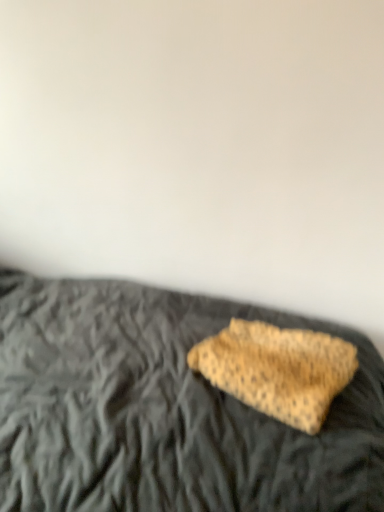
What do you see at coordinates (163, 410) in the screenshot? I see `leopard print pillow at center` at bounding box center [163, 410].

What is the approximate height of leopard print pillow at center?

leopard print pillow at center is 1.03 meters tall.

Locate an element on the screen. This screenshot has width=384, height=512. leopard print pillow at center is located at coordinates (163, 410).

From the picture: What is the approximate height of leopard print fabric at center?

The height of leopard print fabric at center is 3.94 inches.

At what (x,y) coordinates should I click in order to perform the action: click on leopard print fabric at center. Please return your answer as a coordinate pair (x, y). The image size is (384, 512). Looking at the image, I should click on (277, 369).

Describe the element at coordinates (277, 369) in the screenshot. I see `leopard print fabric at center` at that location.

What are the coordinates of `leopard print pillow at center` in the screenshot? It's located at (163, 410).

Which is more to the left, leopard print fabric at center or leopard print pillow at center?

Positioned to the left is leopard print pillow at center.

Which object is closer to the camera, leopard print fabric at center or leopard print pillow at center?

leopard print pillow at center is in front.

Which point is more forward, [209,342] or [25,410]?

The point [25,410] is more forward.

From the image's perspective, is leopard print fabric at center located beneath leopard print pillow at center?

No, from the image's perspective, leopard print fabric at center is not beneath leopard print pillow at center.

From a real-world perspective, is leopard print fabric at center positioned under leopard print pillow at center based on gravity?

No, from a real-world perspective, leopard print fabric at center is not beneath leopard print pillow at center.

Which object is thinner, leopard print fabric at center or leopard print pillow at center?

leopard print fabric at center is thinner.

Considering the sizes of objects leopard print fabric at center and leopard print pillow at center in the image provided, who is taller, leopard print fabric at center or leopard print pillow at center?

leopard print pillow at center.

Does leopard print fabric at center have a larger size compared to leopard print pillow at center?

Incorrect, leopard print fabric at center is not larger than leopard print pillow at center.

Can we say leopard print fabric at center lies outside leopard print pillow at center?

That's incorrect, leopard print fabric at center is not completely outside leopard print pillow at center.

Based on the photo, is leopard print fabric at center next to leopard print pillow at center?

No, leopard print fabric at center is not making contact with leopard print pillow at center.

Could you tell me if leopard print fabric at center is turned towards leopard print pillow at center?

Yes, leopard print fabric at center faces towards leopard print pillow at center.

From the picture: What's the angular difference between leopard print fabric at center and leopard print pillow at center's facing directions?

The facing directions of leopard print fabric at center and leopard print pillow at center are 20.5 degrees apart.

The width and height of the screenshot is (384, 512). Find the location of `bed in front of the leopard print fabric at center`. bed in front of the leopard print fabric at center is located at coordinates (163, 410).

Which is more to the left, leopard print pillow at center or leopard print fabric at center?

leopard print pillow at center is more to the left.

Which object is further away from the camera, leopard print pillow at center or leopard print fabric at center?

leopard print fabric at center is further from the camera.

Is point (1, 362) behind point (314, 355)?

Yes, it is.

From the image's perspective, does leopard print pillow at center appear higher than leopard print fabric at center?

No, from the image's perspective, leopard print pillow at center is not on top of leopard print fabric at center.

From a real-world perspective, is leopard print pillow at center positioned over leopard print fabric at center based on gravity?

Incorrect, from a real-world perspective, leopard print pillow at center is lower than leopard print fabric at center.

Is leopard print pillow at center thinner than leopard print fabric at center?

No, leopard print pillow at center is not thinner than leopard print fabric at center.

Who is taller, leopard print pillow at center or leopard print fabric at center?

Standing taller between the two is leopard print pillow at center.

Considering the relative sizes of leopard print pillow at center and leopard print fabric at center in the image provided, is leopard print pillow at center smaller than leopard print fabric at center?

No.

Do you think leopard print pillow at center is within leopard print fabric at center, or outside of it?

leopard print pillow at center is not inside leopard print fabric at center, it's outside.

Is the surface of leopard print pillow at center in direct contact with leopard print fabric at center?

No.

Is leopard print pillow at center aimed at leopard print fabric at center?

Yes, leopard print pillow at center is aimed at leopard print fabric at center.

How many degrees apart are the facing directions of leopard print pillow at center and leopard print fabric at center?

leopard print pillow at center and leopard print fabric at center are facing 20.5 degrees away from each other.

Locate an element on the screen. bed lying in front of the leopard print fabric at center is located at coordinates (163, 410).

Find the location of a particular element. Image resolution: width=384 pixels, height=512 pixels. sponge above the leopard print pillow at center (from the image's perspective) is located at coordinates (277, 369).

Identify the location of sponge above the leopard print pillow at center (from a real-world perspective). Image resolution: width=384 pixels, height=512 pixels. (277, 369).